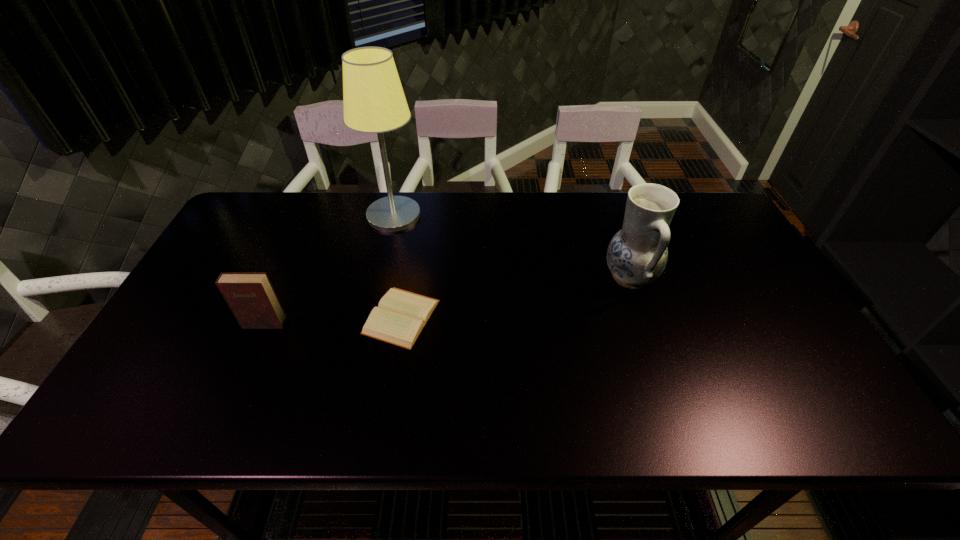
Where is `vacant point located 0.170m on the front cover of the left diary`? This screenshot has width=960, height=540. vacant point located 0.170m on the front cover of the left diary is located at coordinates (235, 388).

What are the coordinates of `vacant space situated 0.260m on the left of the shortest object` in the screenshot? It's located at (264, 317).

This screenshot has width=960, height=540. I want to click on object present at the far edge, so click(x=374, y=102).

Image resolution: width=960 pixels, height=540 pixels. Find the location of `vacant area at the far edge`. vacant area at the far edge is located at coordinates (472, 228).

At what (x,y) coordinates should I click in order to perform the action: click on vacant space at the near edge of the desktop. Please return your answer as a coordinate pair (x, y). This screenshot has width=960, height=540. Looking at the image, I should click on (509, 426).

The height and width of the screenshot is (540, 960). Find the location of `free point at the left edge`. free point at the left edge is located at coordinates (213, 251).

In the image, there is a desktop. Where is `vacant space at the right edge`? This screenshot has height=540, width=960. vacant space at the right edge is located at coordinates (785, 318).

Locate an element on the screen. free space at the far left corner of the desktop is located at coordinates (253, 217).

Where is `vacant area at the far right corner of the desktop`? vacant area at the far right corner of the desktop is located at coordinates (714, 231).

Where is `blank space at the near right corner of the desktop`? blank space at the near right corner of the desktop is located at coordinates (781, 411).